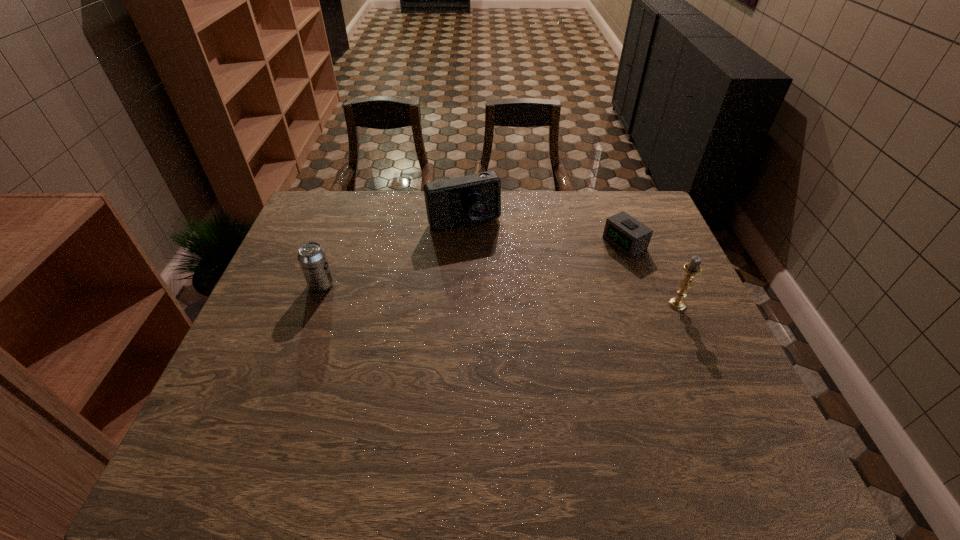
Identify the location of vacant space that's between the third object from right to left and the nearest object. (570, 263).

Where is `vacant space in between the shortest object and the nearest object`? The image size is (960, 540). vacant space in between the shortest object and the nearest object is located at coordinates (651, 274).

Image resolution: width=960 pixels, height=540 pixels. In order to click on free space between the camera and the candle holder in this screenshot , I will do `click(570, 263)`.

The width and height of the screenshot is (960, 540). I want to click on free space between the shortest object and the beer can, so click(473, 264).

Point out which object is positioned as the nearest to the camera. Please provide its 2D coordinates. Your answer should be formatted as a tuple, i.e. [(x, y)], where the tuple contains the x and y coordinates of a point satisfying the conditions above.

[(312, 258)]

I want to click on the second closest object to the nearest object, so click(459, 201).

You are a GUI agent. You are given a task and a screenshot of the screen. Output one action in this format:
    pyautogui.click(x=<x>, y=<y>)
    Task: Click on the free space that satisfies the following two spatial constraints: 1. on the front side of the candle holder; 2. on the left side of the leftmost object
    
    Given the screenshot: What is the action you would take?
    pyautogui.click(x=315, y=305)

Where is `blank area in the image that satisfies the following two spatial constraints: 1. on the front side of the nearest object; 2. on the right side of the leftmost object`? The image size is (960, 540). blank area in the image that satisfies the following two spatial constraints: 1. on the front side of the nearest object; 2. on the right side of the leftmost object is located at coordinates (315, 305).

This screenshot has width=960, height=540. I want to click on vacant region that satisfies the following two spatial constraints: 1. on the front side of the shortest object; 2. on the left side of the candle holder, so click(x=647, y=305).

Where is `vacant space that satisfies the following two spatial constraints: 1. on the back side of the camera; 2. on the right side of the beer can`? Image resolution: width=960 pixels, height=540 pixels. vacant space that satisfies the following two spatial constraints: 1. on the back side of the camera; 2. on the right side of the beer can is located at coordinates (345, 222).